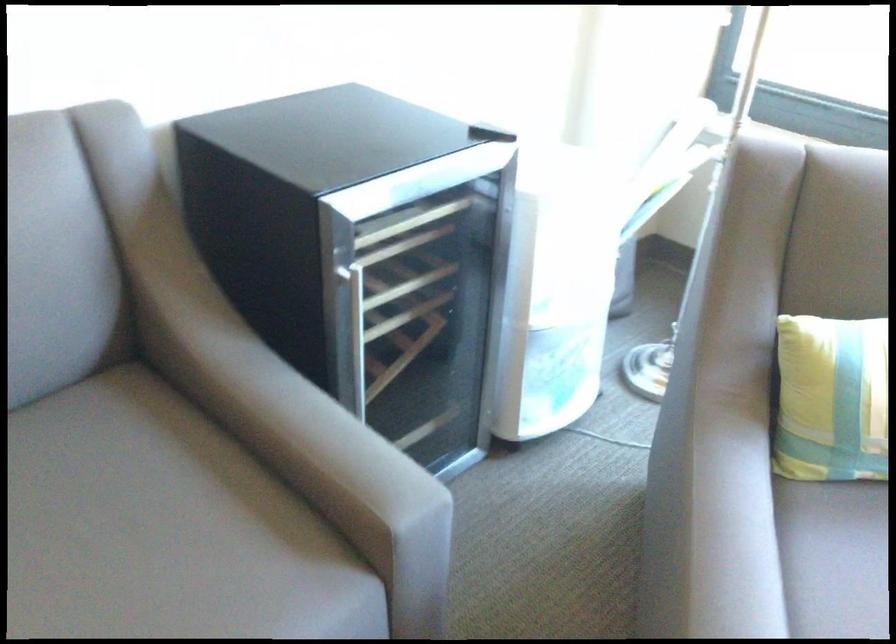
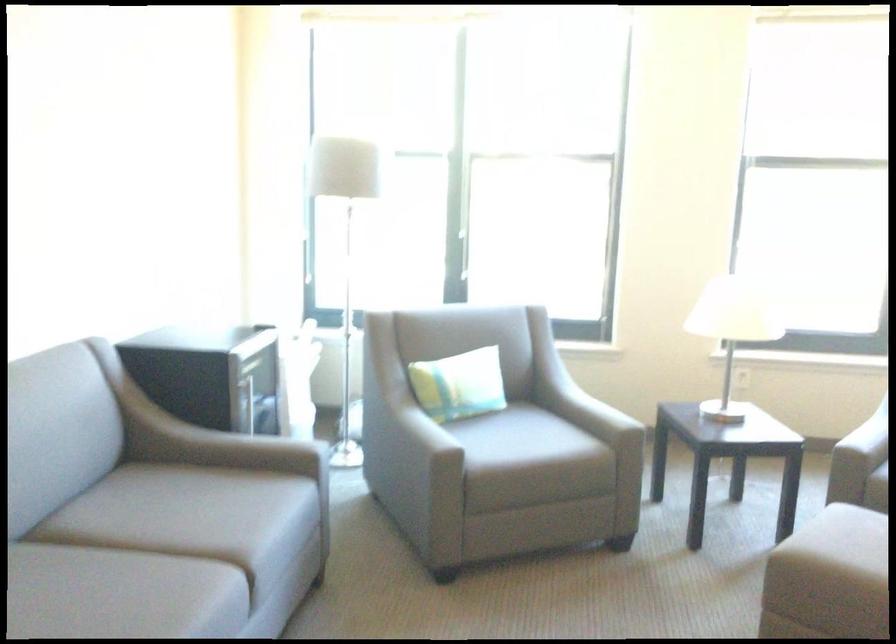
The point at (739, 409) is marked in the first image. Where is the corresponding point in the second image?

(356, 420)